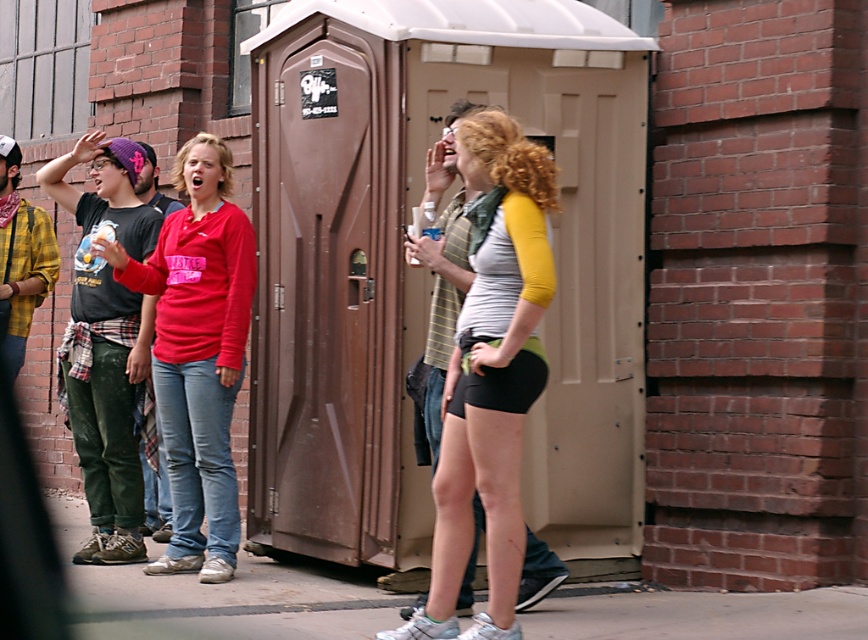
You are standing near the portable toilet and want to find the matte gray shorts at center. According to the coordinates provided, where should you look relative to the portable toilet?

The matte gray shorts at center is located at point 0.588 on the x axis and 0.566 on the y axis relative to the portable toilet.

You are a photographer trying to capture the scene with the portable toilet in the background. You notice the matte gray shorts at center and the matte red shirt at center. Which clothing item is located to the right of the other?

The matte gray shorts at center is positioned on the right side of matte red shirt at center, so the matte gray shorts at center is to the right of the matte red shirt at center.